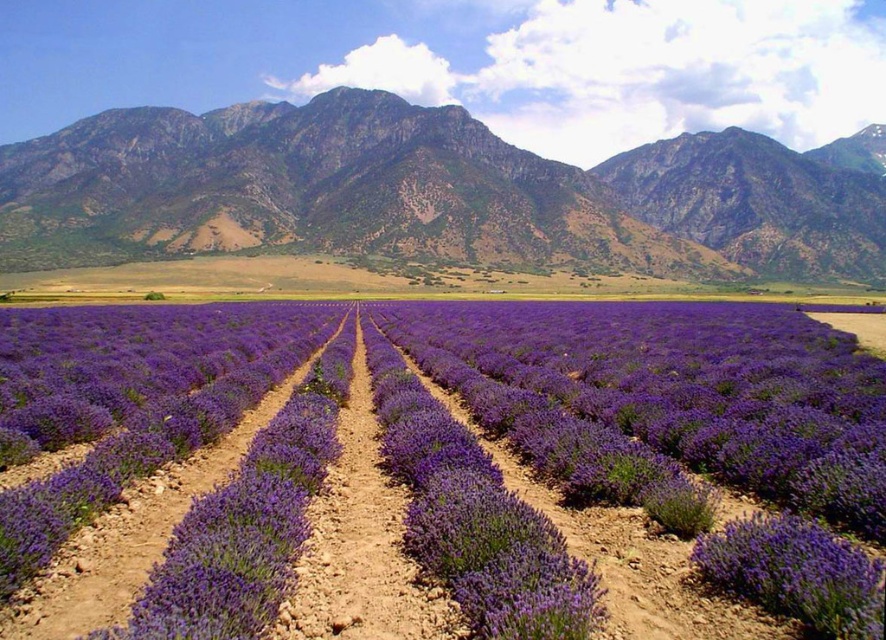
Does rugged stone mountain range at upper center have a greater width compared to purple soft-textured lavender at center?

Yes, rugged stone mountain range at upper center is wider than purple soft-textured lavender at center.

Who is higher up, rugged stone mountain range at upper center or purple soft-textured lavender at center?

rugged stone mountain range at upper center

Is point (32, 212) positioned behind point (465, 317)?

Yes, it is behind point (465, 317).

In order to click on rugged stone mountain range at upper center in this screenshot , I will do 428,193.

From the picture: Can you confirm if purple soft-textured lavender at center is shorter than brown soil path at center?

In fact, purple soft-textured lavender at center may be taller than brown soil path at center.

Is purple soft-textured lavender at center behind brown soil path at center?

No, it is not.

Between point (511, 344) and point (405, 506), which one is positioned behind?

Point (511, 344)

What are the coordinates of `purple soft-textured lavender at center` in the screenshot? It's located at [x=665, y=396].

Who is shorter, rugged stone mountain range at upper center or brown soil path at center?

Standing shorter between the two is brown soil path at center.

Is point (348, 248) farther from camera compared to point (363, 422)?

Yes.

Is point (30, 221) less distant than point (385, 483)?

No, (30, 221) is further to viewer.

Locate an element on the screen. This screenshot has height=640, width=886. rugged stone mountain range at upper center is located at coordinates (428, 193).